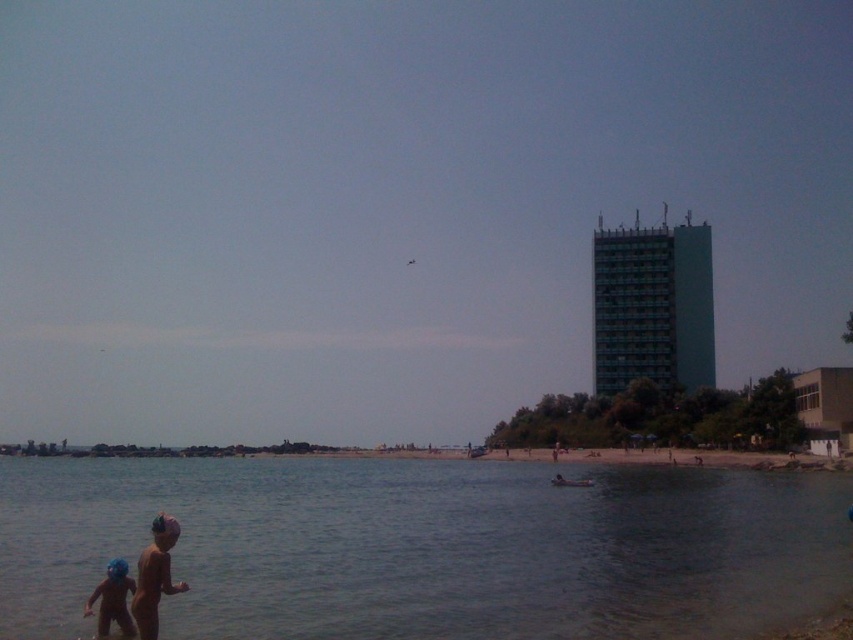
Question: Which point is farther to the camera?

Choices:
 (A) clear water at lower left
 (B) blue rubber helmet at lower left

Answer: (B)

Question: Does clear water at lower left have a larger size compared to blue rubber helmet at lower left?

Choices:
 (A) no
 (B) yes

Answer: (B)

Question: Can you confirm if clear water at lower left is thinner than blue rubber helmet at lower left?

Choices:
 (A) no
 (B) yes

Answer: (A)

Question: Is clear water at lower left bigger than blue rubber helmet at lower left?

Choices:
 (A) yes
 (B) no

Answer: (A)

Question: Which point appears farthest from the camera in this image?

Choices:
 (A) (567, 541)
 (B) (102, 616)

Answer: (A)

Question: Which point is farther from the camera taking this photo?

Choices:
 (A) pyautogui.click(x=113, y=561)
 (B) pyautogui.click(x=93, y=538)

Answer: (B)